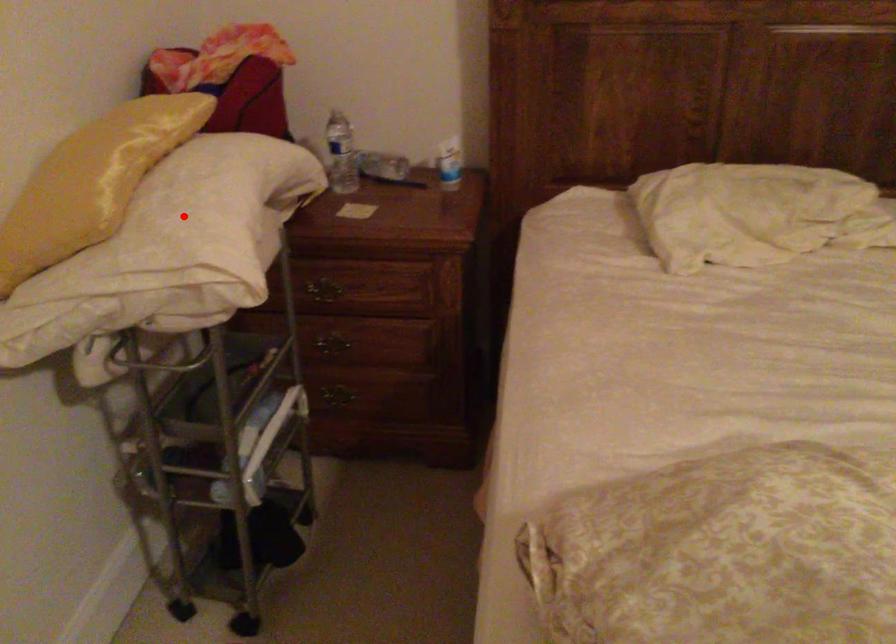
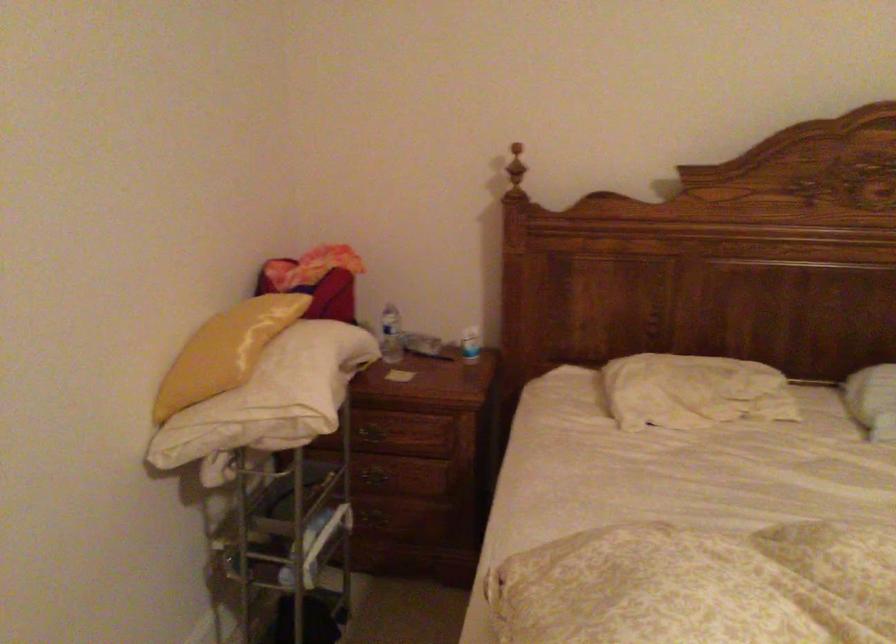
In the second image, find the point that corresponds to the highlighted location in the first image.

(287, 375)